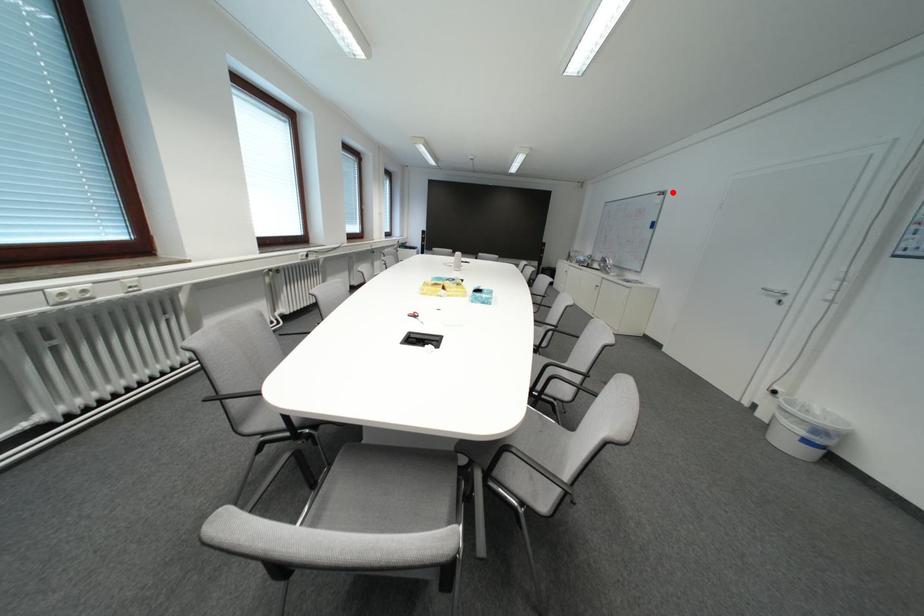
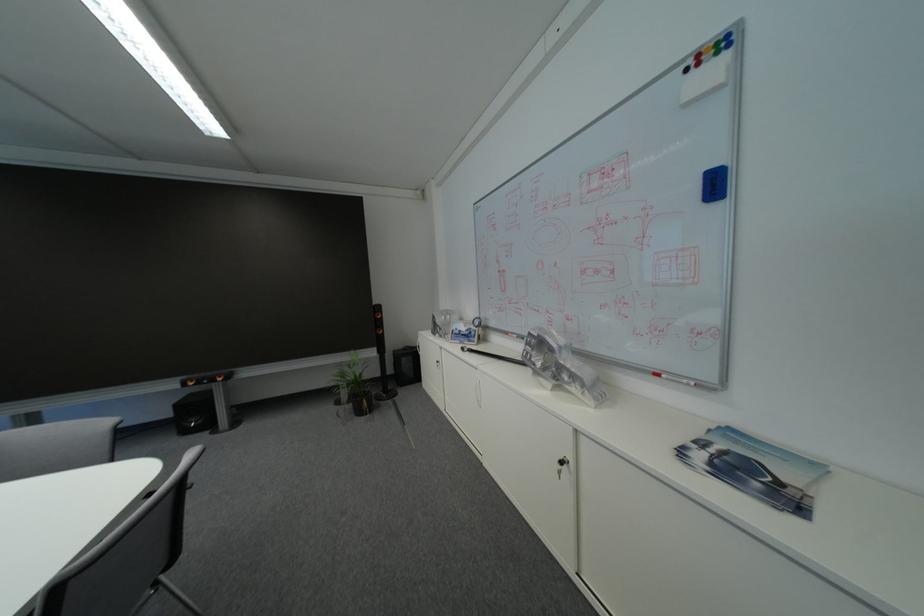
Where in the second image is the point corresponding to the highlighted location from the first image?

(723, 34)